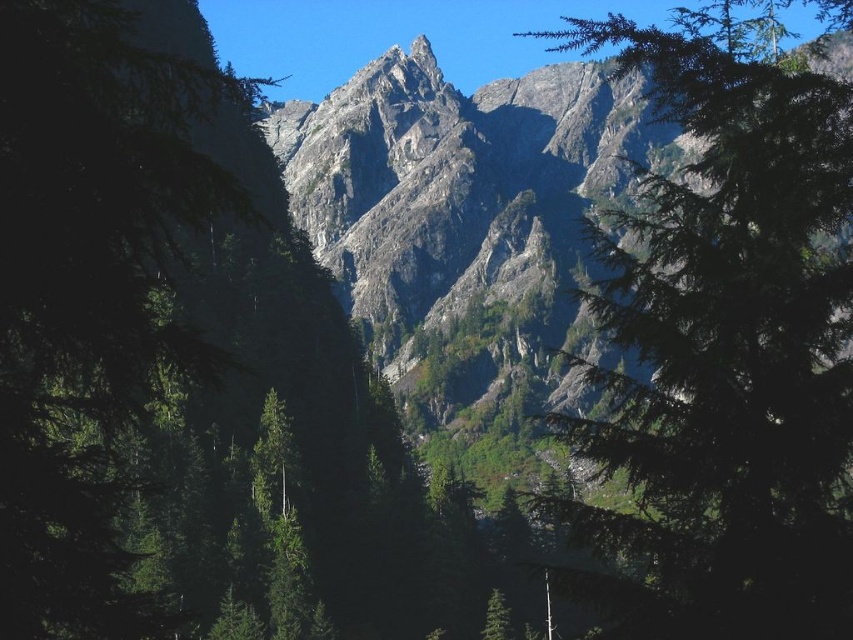
Question: Among these objects, which one is farthest from the camera?

Choices:
 (A) green matte tree at right
 (B) rugged stone mountain range at center

Answer: (B)

Question: Is green matte tree at right bigger than rugged stone mountain range at center?

Choices:
 (A) yes
 (B) no

Answer: (A)

Question: Can you confirm if green matte tree at right is positioned below rugged stone mountain range at center?

Choices:
 (A) yes
 (B) no

Answer: (A)

Question: Which object appears farthest from the camera in this image?

Choices:
 (A) rugged stone mountain range at center
 (B) green matte tree at right

Answer: (A)

Question: Is green matte tree at right positioned in front of rugged stone mountain range at center?

Choices:
 (A) yes
 (B) no

Answer: (A)